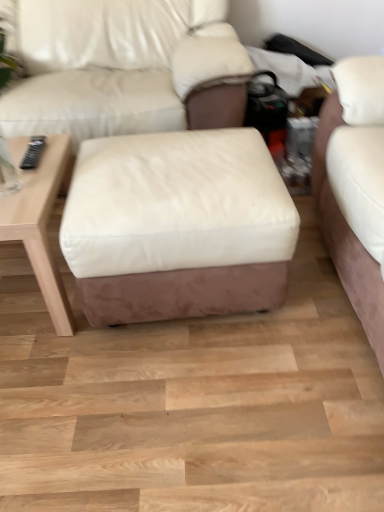
Image resolution: width=384 pixels, height=512 pixels. What are the coordinates of `free space in front of white leather ottoman at center` in the screenshot? It's located at (194, 401).